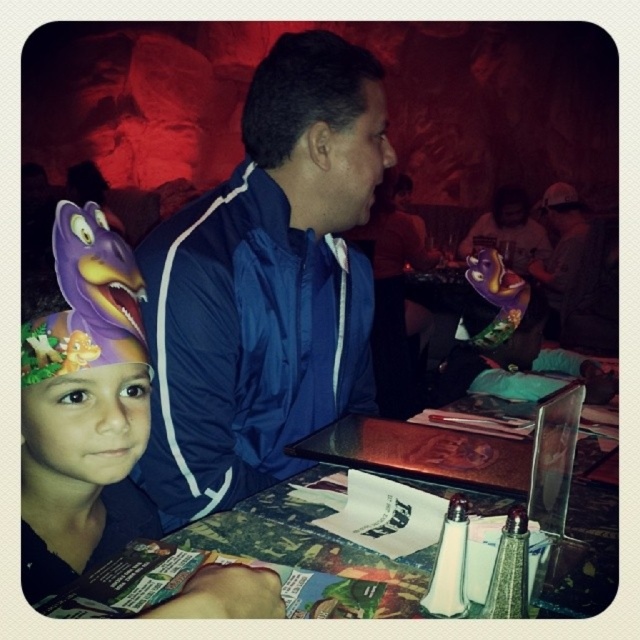
Locate an element on the screen. purple fabric headband at left is located at coordinates (83, 406).

How much distance is there between purple fabric headband at left and dark blue jacket at center?

A distance of 3.54 meters exists between purple fabric headband at left and dark blue jacket at center.

Is point (100, 301) less distant than point (547, 196)?

Yes, it is.

Identify the location of purple fabric headband at left. (83, 406).

This screenshot has height=640, width=640. In order to click on blue nylon jacket at center in this screenshot , I will do (266, 284).

Which is more to the left, blue nylon jacket at center or purple fabric headband at left?

purple fabric headband at left

What do you see at coordinates (266, 284) in the screenshot?
I see `blue nylon jacket at center` at bounding box center [266, 284].

Where is `blue nylon jacket at center`? blue nylon jacket at center is located at coordinates (266, 284).

Which is more to the left, blue nylon jacket at center or dark blue jacket at center?

Positioned to the left is blue nylon jacket at center.

Which is in front, point (294, 88) or point (541, 280)?

Point (294, 88)

Who is more distant from viewer, (314, 140) or (593, 264)?

The point (593, 264) is more distant.

This screenshot has height=640, width=640. What are the coordinates of `blue nylon jacket at center` in the screenshot? It's located at (266, 284).